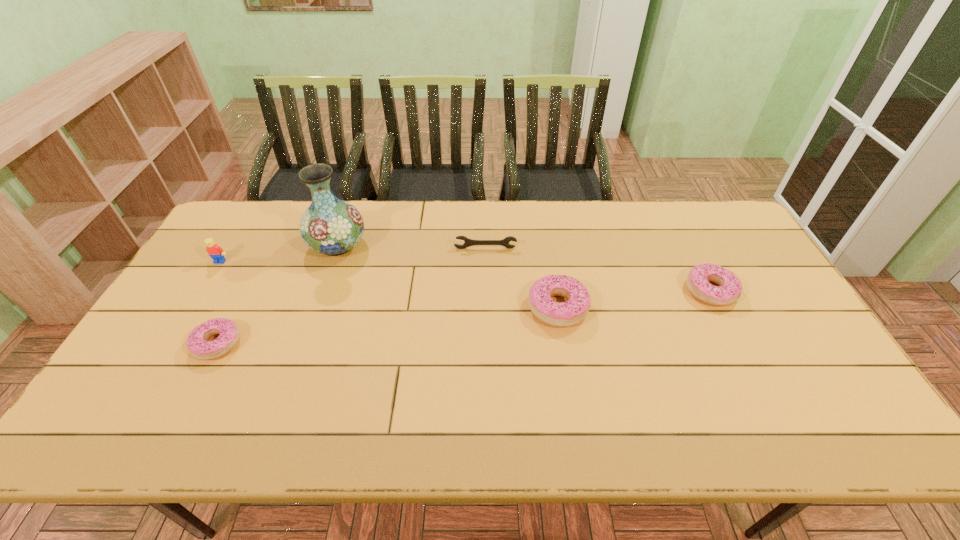
Where is `free space located 0.370m on the right of the second object from left to right`? The height and width of the screenshot is (540, 960). free space located 0.370m on the right of the second object from left to right is located at coordinates (380, 343).

At what (x,y) coordinates should I click in order to perform the action: click on vacant space positioned 0.130m on the front of the fifth object from left to right. Please return your answer as a coordinate pair (x, y). This screenshot has height=540, width=960. Looking at the image, I should click on (568, 373).

I want to click on free space located 0.140m on the back of the rightmost object, so click(686, 244).

Find the location of a particular element. The image size is (960, 540). vacant space located 0.280m on the left of the third object from left to right is located at coordinates (223, 245).

I want to click on vacant area situated 0.380m on the open ends of the fourth object from left to right, so 487,343.

The width and height of the screenshot is (960, 540). I want to click on free space located 0.230m on the face of the Lego, so click(x=184, y=321).

At what (x,y) coordinates should I click in order to perform the action: click on object positioned at the far edge. Please return your answer as a coordinate pair (x, y). Looking at the image, I should click on 330,226.

Locate an element on the screen. The height and width of the screenshot is (540, 960). doughnut situated at the left edge is located at coordinates (197, 344).

In order to click on Lego that is at the left edge in this screenshot , I will do `click(215, 252)`.

Where is `object at the right edge`? The height and width of the screenshot is (540, 960). object at the right edge is located at coordinates (730, 287).